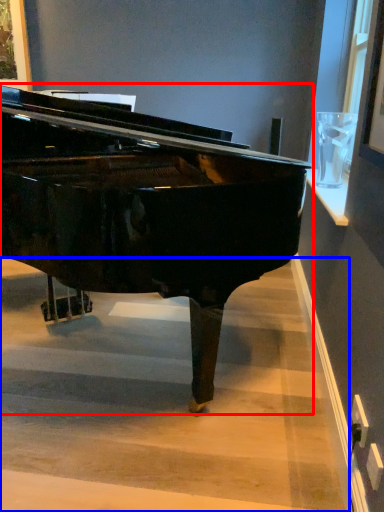
Question: Which object appears closest to the camera in this image, piano (highlighted by a red box) or stairwell (highlighted by a blue box)?

Choices:
 (A) piano
 (B) stairwell

Answer: (A)